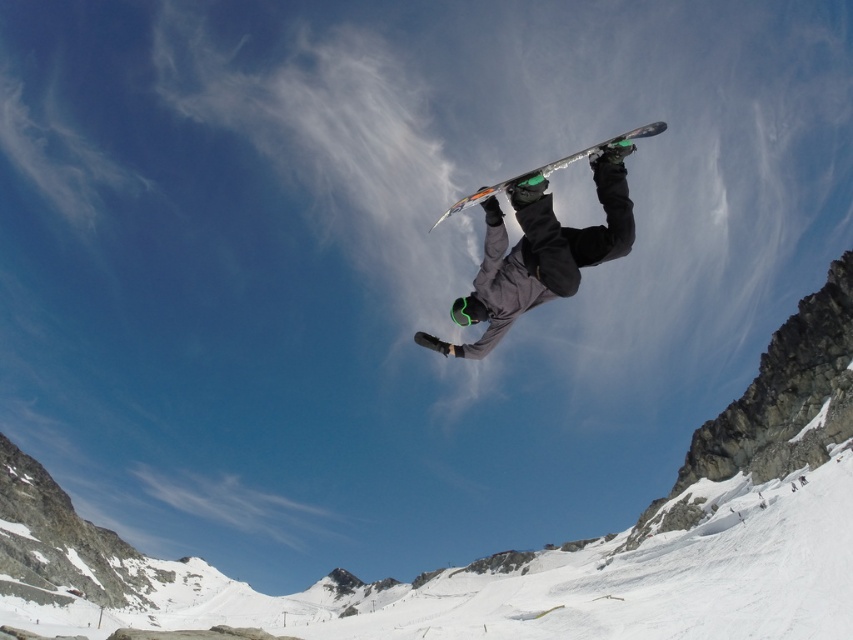
You are analyzing the snowboarder midair and want to determine which of the two points, point [543,204] or point [640,134], is closer to you. Based on the spatial relationship between them, which point is nearer?

Point [543,204] is closer to the viewer than point [640,134].

You are a photographer capturing the snowboarder midair. You notice the matte black snowboarder at center and the shiny metallic snowboard at center. Which object appears larger in your photo?

The shiny metallic snowboard at center appears larger in the photo because it is bigger than the matte black snowboarder at center.

Based on the photo, you are a photographer capturing the snowboarder midair. You notice the matte black snowboarder at center and the shiny metallic snowboard at center. Which object is positioned lower in the image?

The matte black snowboarder at center is positioned lower than the shiny metallic snowboard at center.